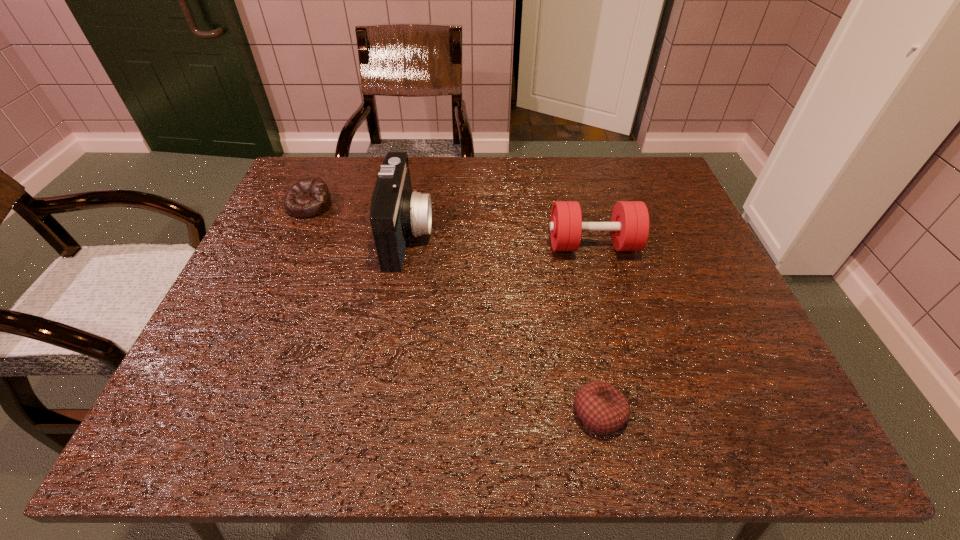
At what (x,y) coordinates should I click in order to perform the action: click on camcorder. Please return your answer as a coordinate pair (x, y). Looking at the image, I should click on (396, 212).

In order to click on the second object from left to right in this screenshot , I will do `click(396, 212)`.

Locate an element on the screen. This screenshot has height=540, width=960. dumbbell is located at coordinates (629, 226).

At what (x,y) coordinates should I click in order to perform the action: click on the leftmost object. Please return your answer as a coordinate pair (x, y). Looking at the image, I should click on (309, 197).

Locate an element on the screen. This screenshot has height=540, width=960. the left beanbag is located at coordinates (309, 197).

Where is `the nearest object`? the nearest object is located at coordinates (601, 407).

Find the location of `the nearer beanbag`. the nearer beanbag is located at coordinates (601, 407).

Where is `free region located on the lens of the camcorder`? This screenshot has height=540, width=960. free region located on the lens of the camcorder is located at coordinates (479, 235).

Find the location of a particular element. This screenshot has height=540, width=960. vacant point located on the front of the dumbbell is located at coordinates (605, 289).

Locate an element on the screen. This screenshot has height=540, width=960. vacant area situated 0.200m on the front of the farther beanbag is located at coordinates (279, 273).